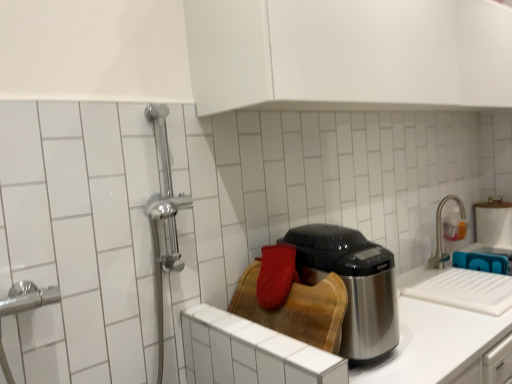
Describe the element at coordinates (352, 285) in the screenshot. Image resolution: width=512 pixels, height=384 pixels. I see `shiny metallic appliance at center` at that location.

Where is `satin nickel faucet at upper right`? satin nickel faucet at upper right is located at coordinates pos(442,233).

This screenshot has width=512, height=384. What do you see at coordinates (251, 353) in the screenshot?
I see `wooden cutting board at center` at bounding box center [251, 353].

Measure the distance between point (441, 367) and camera.

Point (441, 367) is 3.90 feet from camera.

Describe the element at coordinates (432, 342) in the screenshot. I see `satin steel counter top at center` at that location.

Locate an element on the screen. Image resolution: width=512 pixels, height=384 pixels. shiny metallic appliance at center is located at coordinates (352, 285).

Does wooden cutting board at center have a lesser height compared to satin steel counter top at center?

Yes.

Is wooden cutting board at center thinner than satin steel counter top at center?

Correct, the width of wooden cutting board at center is less than that of satin steel counter top at center.

Is wooden cutting board at center at the right side of satin steel counter top at center?

No.

Which is correct: shiny metallic appliance at center is inside satin nickel faucet at upper right, or outside of it?

shiny metallic appliance at center cannot be found inside satin nickel faucet at upper right.

Are shiny metallic appliance at center and satin nickel faucet at upper right located far from each other?

shiny metallic appliance at center is far away from satin nickel faucet at upper right.

Who is shorter, shiny metallic appliance at center or satin nickel faucet at upper right?

With less height is satin nickel faucet at upper right.

Who is more distant, shiny metallic appliance at center or wooden cutting board at center?

shiny metallic appliance at center is behind.

The image size is (512, 384). What are the coordinates of `kitchen appliance above the wooden cutting board at center (from the image's perspective)` in the screenshot? It's located at (352, 285).

Considering the sizes of objects shiny metallic appliance at center and wooden cutting board at center in the image provided, who is bigger, shiny metallic appliance at center or wooden cutting board at center?

With larger size is shiny metallic appliance at center.

Is shiny metallic appliance at center far from wooden cutting board at center?

That's not correct — shiny metallic appliance at center is a little close to wooden cutting board at center.

Measure the distance between shiny metallic appliance at center and satin steel counter top at center.

8.40 inches.

Between shiny metallic appliance at center and satin steel counter top at center, which one is positioned behind?

satin steel counter top at center is further from the camera.

From the image's perspective, which is below, shiny metallic appliance at center or satin steel counter top at center?

satin steel counter top at center, from the image's perspective.

Looking at their sizes, would you say shiny metallic appliance at center is wider or thinner than satin steel counter top at center?

Considering their sizes, shiny metallic appliance at center looks slimmer than satin steel counter top at center.

From the image's perspective, between satin steel counter top at center and shiny metallic appliance at center, which one is located above?

shiny metallic appliance at center is shown above in the image.

Is satin steel counter top at center with shiny metallic appliance at center?

No, satin steel counter top at center is not in contact with shiny metallic appliance at center.

From a real-world perspective, is satin steel counter top at center above or below shiny metallic appliance at center?

Clearly, from a real-world perspective, satin steel counter top at center is below shiny metallic appliance at center.

Can you confirm if satin steel counter top at center is taller than shiny metallic appliance at center?

Yes.

Would you say satin nickel faucet at upper right is a long distance from shiny metallic appliance at center?

Yes, satin nickel faucet at upper right and shiny metallic appliance at center are located far from each other.

From a real-world perspective, is satin nickel faucet at upper right positioned above or below shiny metallic appliance at center?

From a real-world perspective, satin nickel faucet at upper right is physically below shiny metallic appliance at center.

Which is behind, point (436, 265) or point (354, 323)?

The point (436, 265) is farther from the camera.

Between satin nickel faucet at upper right and shiny metallic appliance at center, which one has larger size?

shiny metallic appliance at center is bigger.

From a real-world perspective, which object rests below the other?

wooden cutting board at center is physically lower.

Find the location of a particular element. The height and width of the screenshot is (384, 512). cabinetry in front of the satin nickel faucet at upper right is located at coordinates (251, 353).

Does satin nickel faucet at upper right lie behind wooden cutting board at center?

Yes.

Is satin nickel faucet at upper right thinner than wooden cutting board at center?

Indeed, satin nickel faucet at upper right has a lesser width compared to wooden cutting board at center.

At what (x,y) coordinates should I click in order to perform the action: click on cabinetry located on the left of satin steel counter top at center. Please return your answer as a coordinate pair (x, y). The image size is (512, 384). Looking at the image, I should click on (251, 353).

Image resolution: width=512 pixels, height=384 pixels. I want to click on kitchen appliance above the satin nickel faucet at upper right (from a real-world perspective), so click(352, 285).

Looking at the image, which one is located further to shiny metallic appliance at center, wooden cutting board at center or satin steel counter top at center?

The object further to shiny metallic appliance at center is wooden cutting board at center.

Based on their spatial positions, is shiny metallic appliance at center or wooden cutting board at center further from satin steel counter top at center?

wooden cutting board at center.

Which object lies further to the anchor point shiny metallic appliance at center, wooden cutting board at center or satin nickel faucet at upper right?

The object further to shiny metallic appliance at center is satin nickel faucet at upper right.

Considering their positions, is satin nickel faucet at upper right positioned further to satin steel counter top at center than shiny metallic appliance at center?

satin nickel faucet at upper right.

When comparing their distances from satin nickel faucet at upper right, does wooden cutting board at center or shiny metallic appliance at center seem further?

Among the two, wooden cutting board at center is located further to satin nickel faucet at upper right.

Which object lies nearer to the anchor point satin steel counter top at center, shiny metallic appliance at center or satin nickel faucet at upper right?

Among the two, shiny metallic appliance at center is located nearer to satin steel counter top at center.

Based on their spatial positions, is satin nickel faucet at upper right or shiny metallic appliance at center further from wooden cutting board at center?

satin nickel faucet at upper right.

Which object lies nearer to the anchor point satin nickel faucet at upper right, shiny metallic appliance at center or satin steel counter top at center?

The object closer to satin nickel faucet at upper right is satin steel counter top at center.

Find the location of a particular element. The width and height of the screenshot is (512, 384). kitchen appliance between wooden cutting board at center and satin nickel faucet at upper right along the z-axis is located at coordinates (352, 285).

Locate an element on the screen. counter top between wooden cutting board at center and satin nickel faucet at upper right along the z-axis is located at coordinates (432, 342).

Where is `kitchen appliance between wooden cutting board at center and satin steel counter top at center from left to right`? kitchen appliance between wooden cutting board at center and satin steel counter top at center from left to right is located at coordinates (352, 285).

The height and width of the screenshot is (384, 512). What are the coordinates of `counter top located between shiny metallic appliance at center and satin nickel faucet at upper right in the depth direction` in the screenshot? It's located at (432, 342).